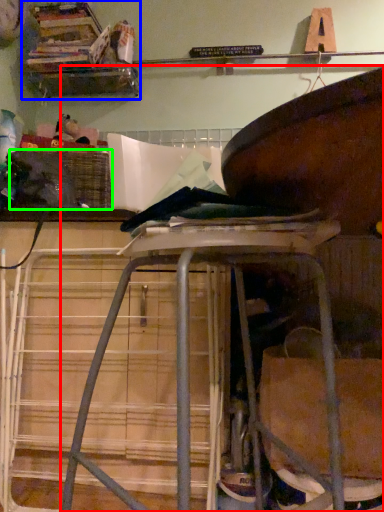
Question: Based on their relative distances, which object is nearer to furniture (highlighted by a red box)? Choose from shelf (highlighted by a blue box) and crate (highlighted by a green box).

Choices:
 (A) shelf
 (B) crate

Answer: (B)